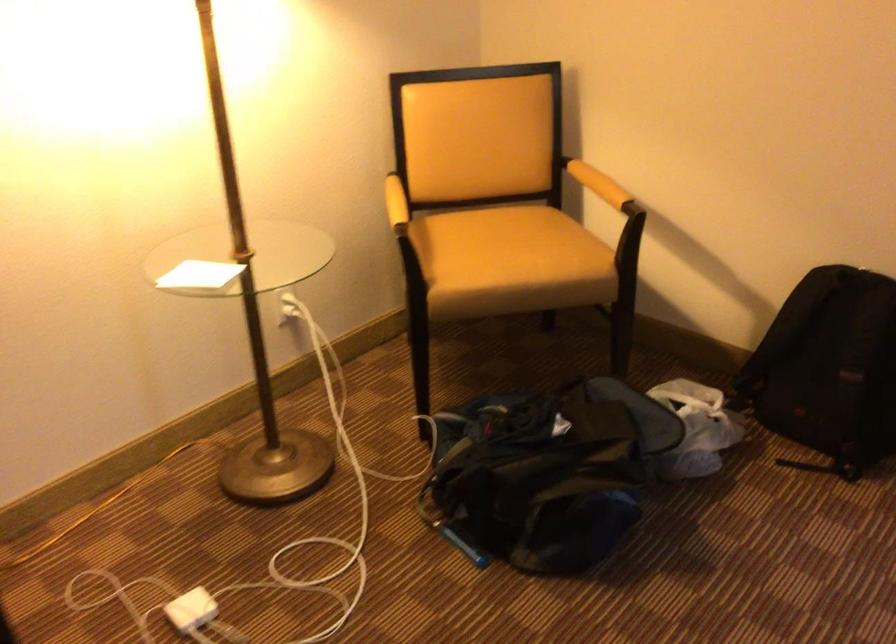
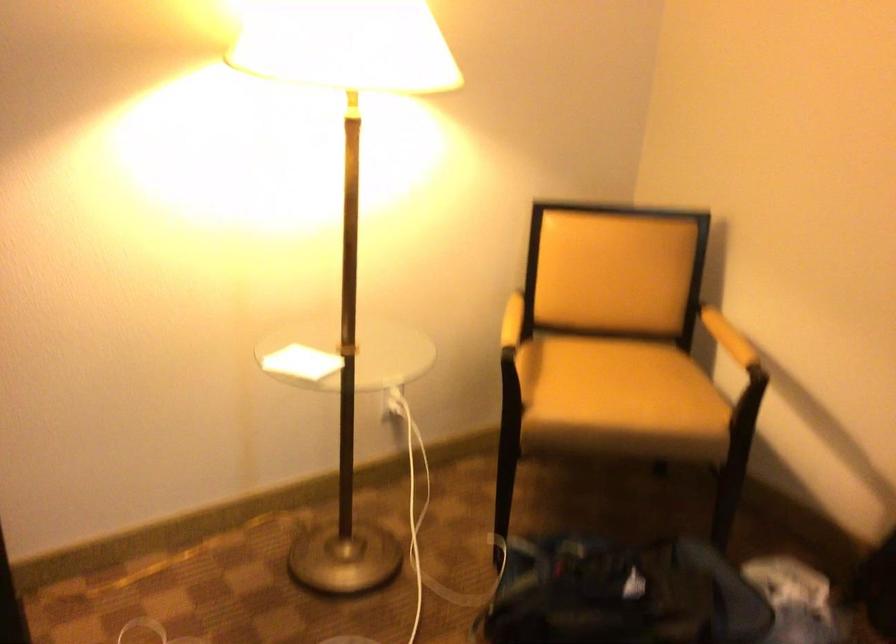
Where in the second image is the point corresponding to point (203, 275) from the first image?

(300, 363)